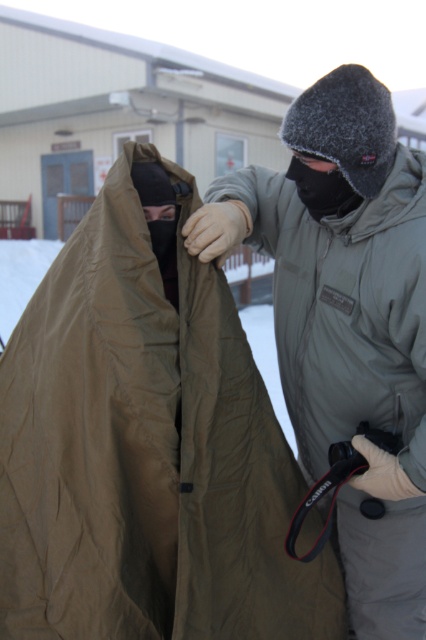
Question: Is olive green fabric coat at center smaller than olive-green fabric coat at center?

Choices:
 (A) no
 (B) yes

Answer: (B)

Question: Which object appears farthest from the camera in this image?

Choices:
 (A) olive-green fabric coat at center
 (B) olive green fabric coat at center

Answer: (A)

Question: Is olive green fabric coat at center above olive-green fabric coat at center?

Choices:
 (A) no
 (B) yes

Answer: (A)

Question: Which object is farther from the camera taking this photo?

Choices:
 (A) olive-green fabric coat at center
 (B) olive green fabric coat at center

Answer: (A)

Question: Can you confirm if olive green fabric coat at center is positioned above olive-green fabric coat at center?

Choices:
 (A) no
 (B) yes

Answer: (A)